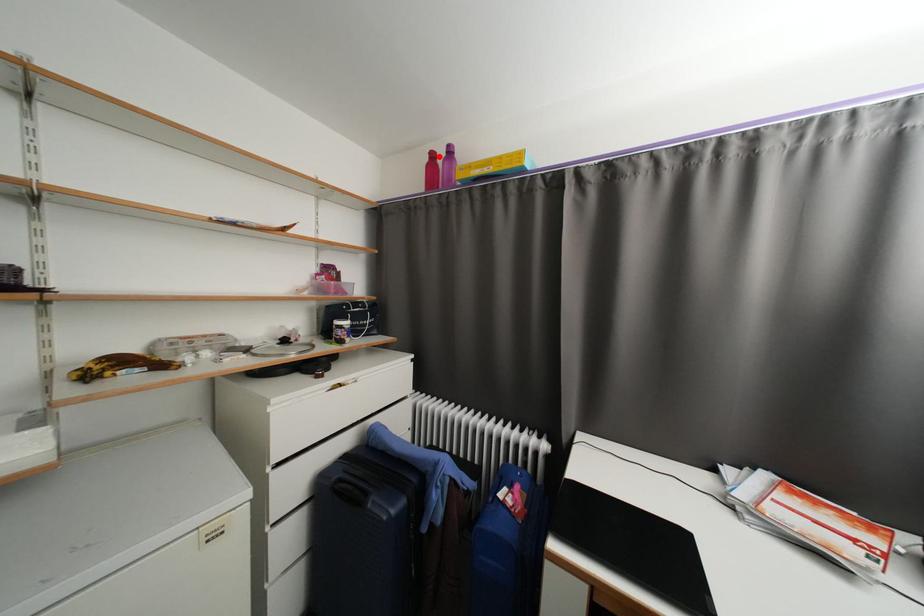
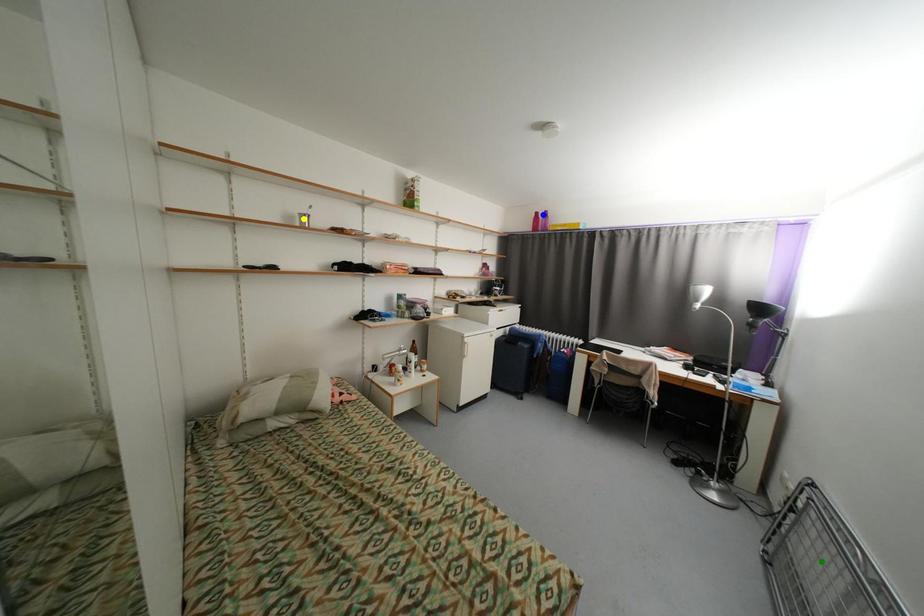
Question: I am providing you with two images of the same scene from different viewpoints. A red point is marked on the first image. You are given multiple points on the second image. Which mark in image 2 goes with the point in image 1?

Choices:
 (A) green point
 (B) yellow point
 (C) blue point

Answer: (C)